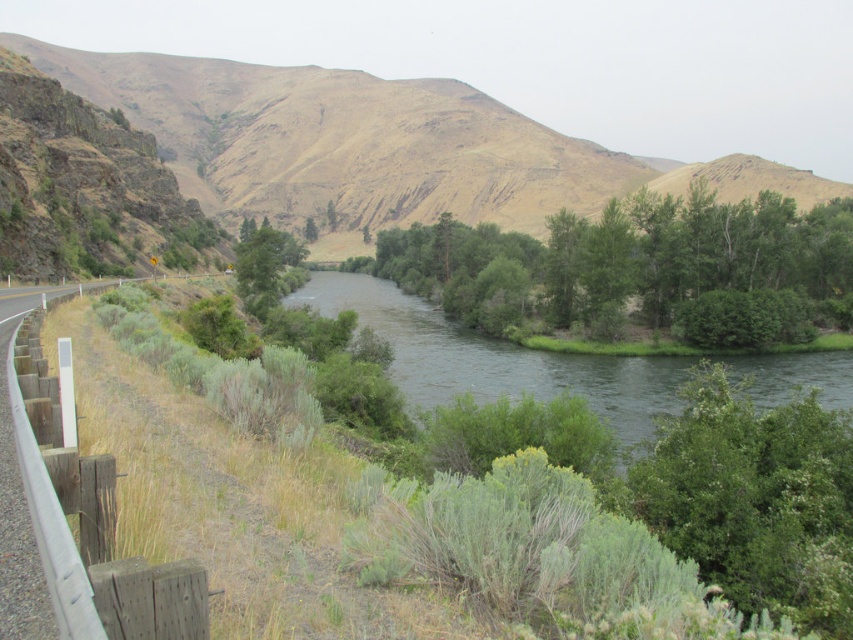
You are standing on the road near the wooden guardrail. You want to take a photo of the green leafy river at center. In which direction should you point your camera?

The green leafy river at center is located at point coordinates (494, 356), which corresponds to the central area of the image. Therefore, you should point your camera towards the center of the scene to capture the green leafy river at center.

You are driving along the road and see the green leafy river at center and the green leafy tree at center. Which one is closer to you?

The green leafy river at center is closer to you because it is in front of the green leafy tree at center.

You are standing on the road next to the wooden guardrail and looking towards the river. There is a point marked at coordinates (x=637, y=268). What can you see at that point?

At point (x=637, y=268), there are green leafy trees at center.